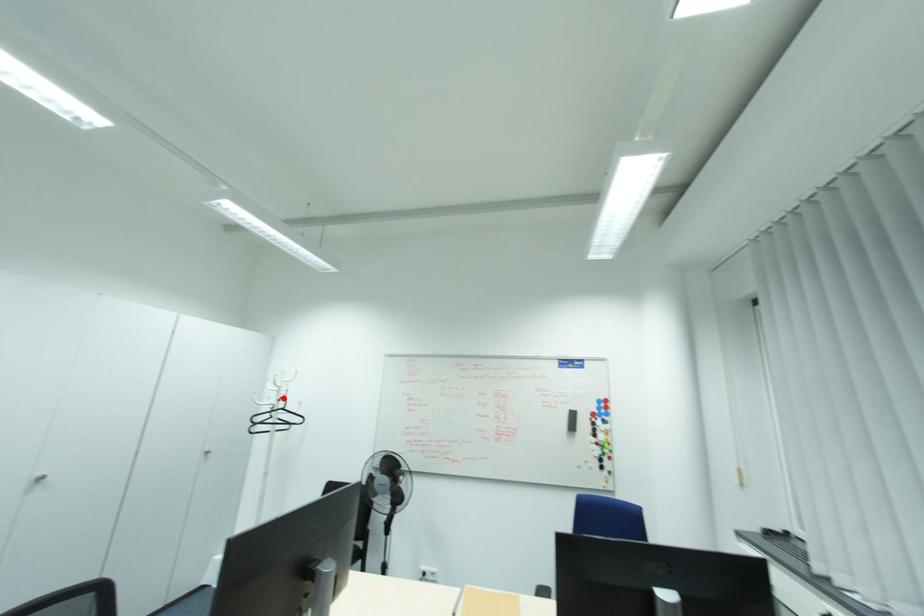
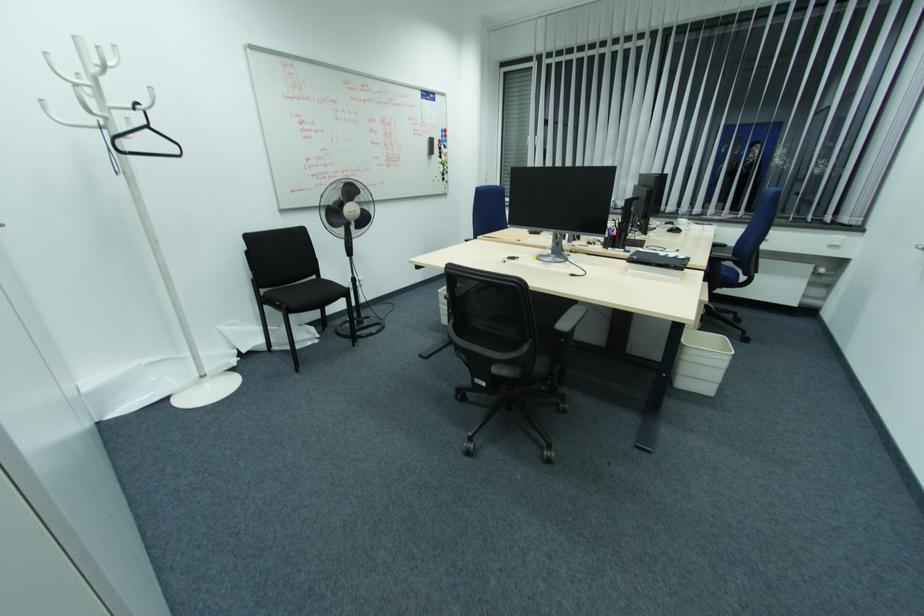
Where in the second image is the point corresponding to the highlighted location from the first image?

(139, 105)